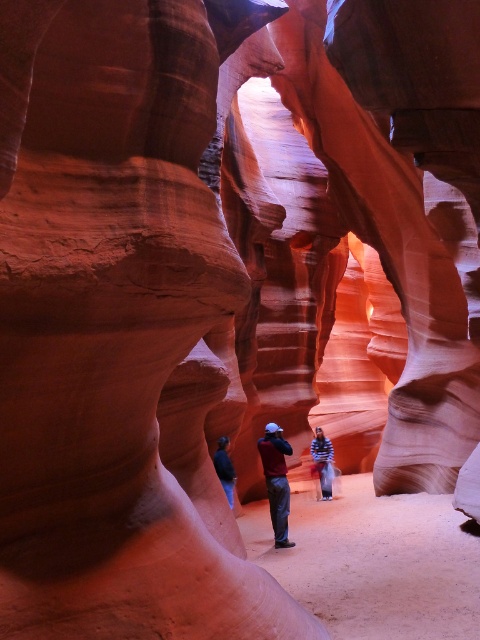
Question: Which of the following is the closest to the observer?

Choices:
 (A) click(x=235, y=483)
 (B) click(x=314, y=458)

Answer: (A)

Question: Which point is closer to the camera taking this photo?

Choices:
 (A) (324, 468)
 (B) (263, 464)
 (C) (226, 470)

Answer: (C)

Question: Is maroon fabric shirt at center positioned in front of striped shirt at center?

Choices:
 (A) yes
 (B) no

Answer: (A)

Question: Can you confirm if striped shirt at center is smaller than dark blue jeans at center?

Choices:
 (A) yes
 (B) no

Answer: (B)

Question: Among these objects, which one is farthest from the camera?

Choices:
 (A) striped shirt at center
 (B) dark blue jeans at center

Answer: (A)

Question: Is striped shirt at center behind dark blue jeans at center?

Choices:
 (A) no
 (B) yes

Answer: (B)